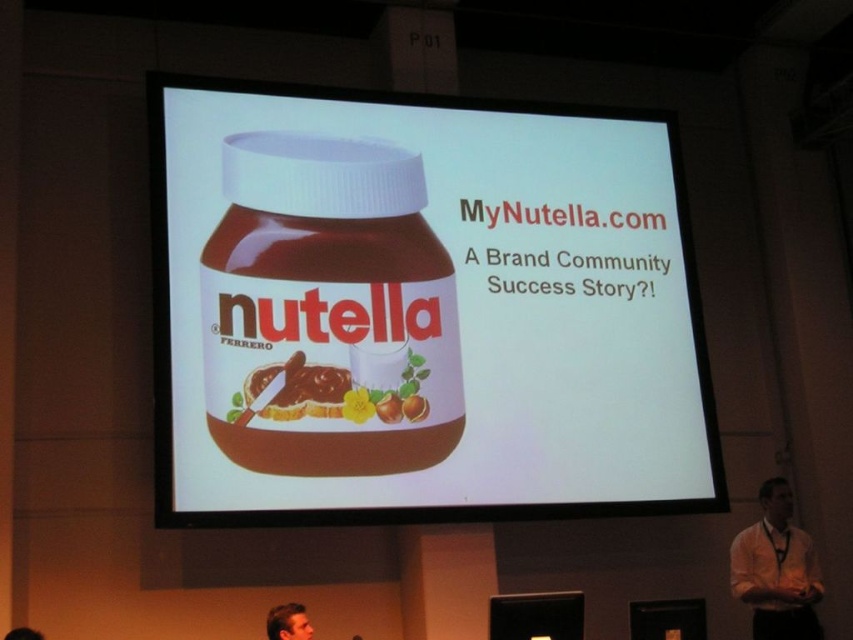
Question: In this image, where is matte plastic jar of nutella at center located relative to chocolate spread at center?

Choices:
 (A) right
 (B) left

Answer: (A)

Question: Which of the following is the closest to the observer?

Choices:
 (A) (306, 627)
 (B) (173, 449)

Answer: (A)

Question: Which object appears closest to the camera in this image?

Choices:
 (A) matte plastic jar of nutella at center
 (B) chocolate spread at center
 (C) smooth skin face at lower center
 (D) white shirt at lower right

Answer: (C)

Question: Considering the relative positions of chocolate spread at center and smooth skin face at lower center in the image provided, where is chocolate spread at center located with respect to smooth skin face at lower center?

Choices:
 (A) left
 (B) right

Answer: (A)

Question: Which of the following is the farthest from the observer?

Choices:
 (A) smooth skin face at lower center
 (B) white shirt at lower right

Answer: (B)

Question: Is matte plastic jar of nutella at center thinner than chocolate spread at center?

Choices:
 (A) no
 (B) yes

Answer: (A)